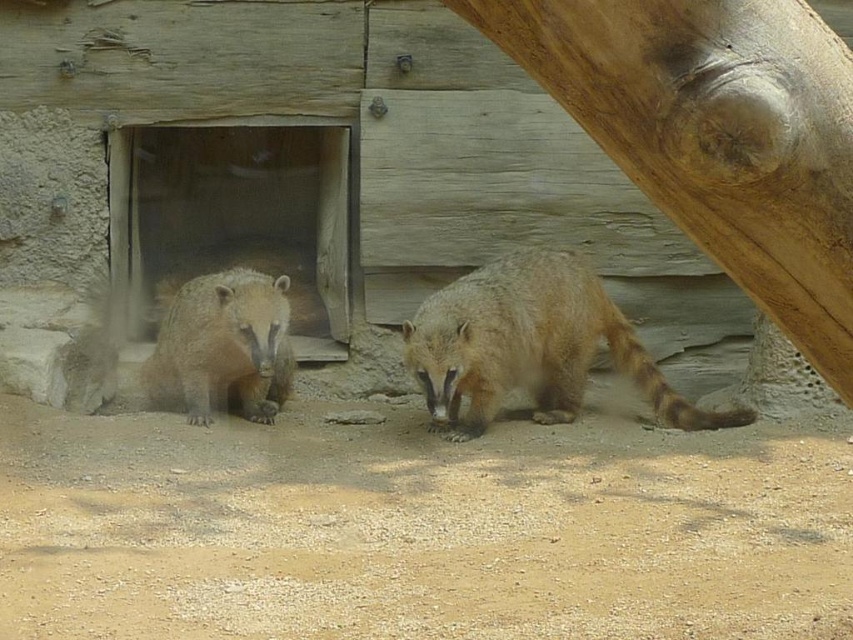
You are standing at the center of the enclosure and want to find the smooth brown tree trunk at right. According to the coordinates provided, in which direction should you look to locate it?

The smooth brown tree trunk at right is located at coordinates point (717, 134). Since you are at the center, looking to the right side of the enclosure will help you find it.